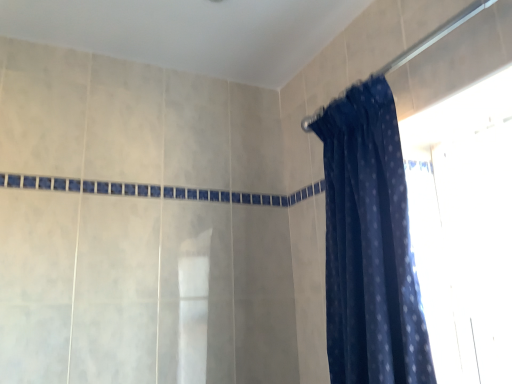
Question: Is dark blue fabric at upper right taller or shorter than dark blue sheer at upper right?

Choices:
 (A) short
 (B) tall

Answer: (A)

Question: Considering their positions, is dark blue fabric at upper right located in front of or behind dark blue sheer at upper right?

Choices:
 (A) behind
 (B) front

Answer: (B)

Question: From the image's perspective, is dark blue fabric at upper right positioned above or below dark blue sheer at upper right?

Choices:
 (A) below
 (B) above

Answer: (B)

Question: In terms of width, does dark blue sheer at upper right look wider or thinner when compared to dark blue fabric at upper right?

Choices:
 (A) thin
 (B) wide

Answer: (B)

Question: From the image's perspective, is dark blue sheer at upper right above or below dark blue fabric at upper right?

Choices:
 (A) below
 (B) above

Answer: (A)

Question: Based on their sizes in the image, would you say dark blue sheer at upper right is bigger or smaller than dark blue fabric at upper right?

Choices:
 (A) small
 (B) big

Answer: (B)

Question: From their relative heights in the image, would you say dark blue sheer at upper right is taller or shorter than dark blue fabric at upper right?

Choices:
 (A) short
 (B) tall

Answer: (B)